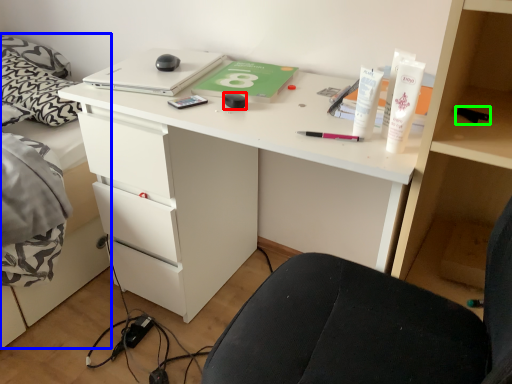
Question: Which object is the farthest from stationery (highlighted by a red box)? Choose among these: bed (highlighted by a blue box) or stationery (highlighted by a green box).

Choices:
 (A) bed
 (B) stationery

Answer: (A)